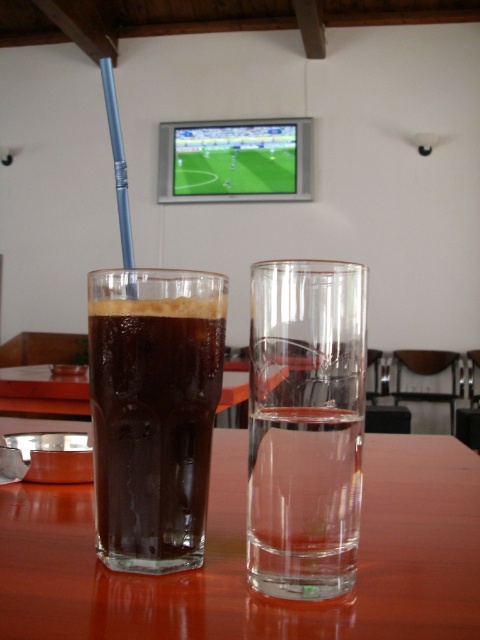
Does transparent glass table at center appear on the left side of dark matte glass at left?

Incorrect, transparent glass table at center is not on the left side of dark matte glass at left.

Is point (251, 616) farther from viewer compared to point (111, 461)?

No, (251, 616) is closer to viewer.

In order to click on transparent glass table at center in this screenshot , I will do `click(244, 557)`.